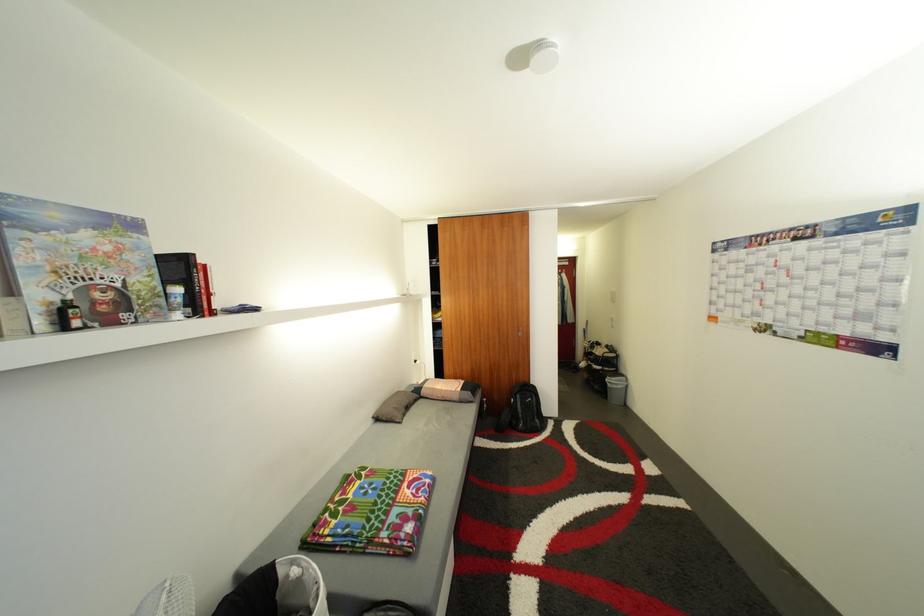
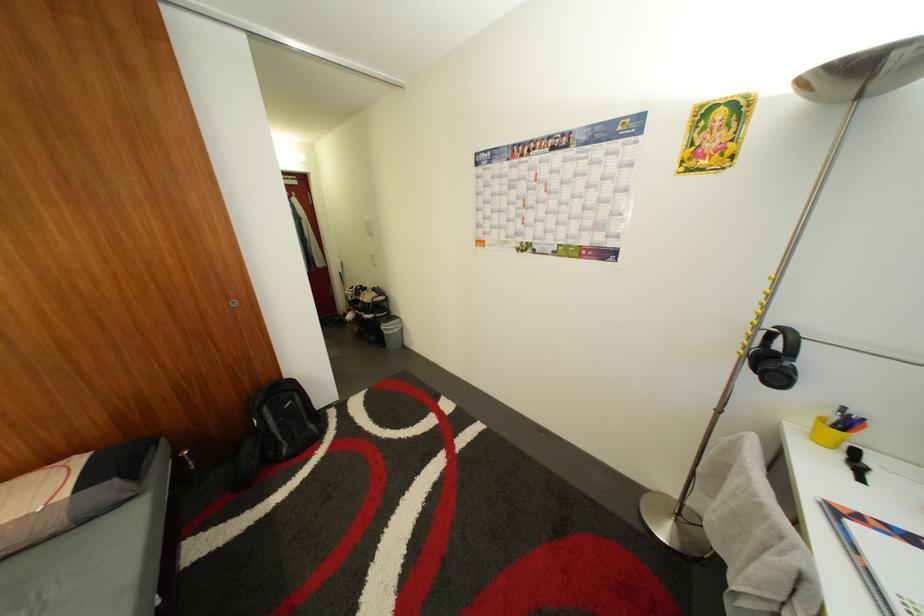
Based on the continuous images, in which direction is the camera rotating?

The rotation direction of the camera is right-down.